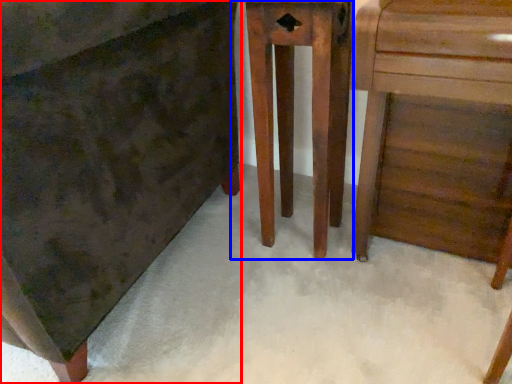
Question: Which object is further to the camera taking this photo, chest of drawers (highlighted by a red box) or furniture (highlighted by a blue box)?

Choices:
 (A) chest of drawers
 (B) furniture

Answer: (B)